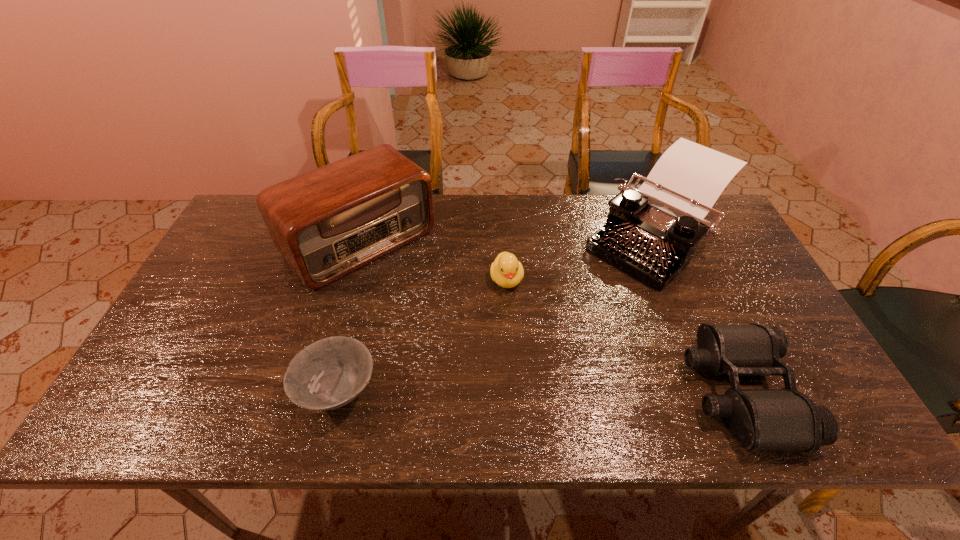
Where is `free space between the duckling and the radio receiver`? The width and height of the screenshot is (960, 540). free space between the duckling and the radio receiver is located at coordinates (433, 261).

This screenshot has width=960, height=540. What are the coordinates of `the third closest object to the binoculars` in the screenshot? It's located at (326, 223).

Find the location of a particular element. The height and width of the screenshot is (540, 960). object that can be found as the fourth closest to the binoculars is located at coordinates click(x=327, y=374).

The height and width of the screenshot is (540, 960). I want to click on vacant space that satisfies the following two spatial constraints: 1. on the back side of the typewriter; 2. on the left side of the third object from left to right, so click(x=504, y=237).

Locate an element on the screen. This screenshot has height=540, width=960. vacant area in the image that satisfies the following two spatial constraints: 1. on the front side of the binoculars; 2. through the eyepieces of the radio receiver is located at coordinates (318, 392).

Locate an element on the screen. The height and width of the screenshot is (540, 960). free space that satisfies the following two spatial constraints: 1. on the front side of the binoculars; 2. through the eyepieces of the radio receiver is located at coordinates (318, 392).

You are a GUI agent. You are given a task and a screenshot of the screen. Output one action in this format:
    pyautogui.click(x=<x>, y=<y>)
    Task: Click on the vacant area that satisfies the following two spatial constraints: 1. on the back side of the duckling; 2. on the right side of the bowl
    This screenshot has width=960, height=540.
    Given the screenshot: What is the action you would take?
    pyautogui.click(x=367, y=279)